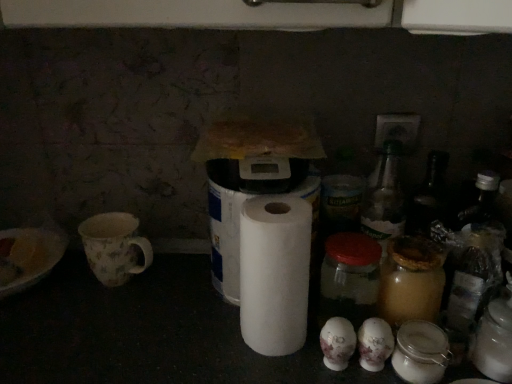
Question: Considering the positions of point (310, 196) and point (279, 344), is point (310, 196) closer or farther from the camera than point (279, 344)?

Choices:
 (A) farther
 (B) closer

Answer: (A)

Question: Visually, is white matte toilet paper at center, the third toilet paper positioned from the right, positioned to the left or to the right of white paper at center?

Choices:
 (A) left
 (B) right

Answer: (A)

Question: Estimate the real-world distances between objects in this image. Which object is farther from the white paper at center?

Choices:
 (A) white matte toilet paper at lower center, acting as the second toilet paper starting from the left
 (B) white matte toilet paper at center, positioned as the third toilet paper in left-to-right order
 (C) transparent glass jar at center
 (D) floral ceramic mug at left
 (E) white matte toilet paper at center, the third toilet paper positioned from the right

Answer: (D)

Question: Which is farther from the white paper at center?

Choices:
 (A) transparent glass jar at center
 (B) white matte toilet paper at center, the 1th toilet paper positioned from the right
 (C) white matte toilet paper at lower center, positioned as the second toilet paper in right-to-left order
 (D) white matte toilet paper at center, the third toilet paper positioned from the right
 (E) floral ceramic mug at left

Answer: (E)